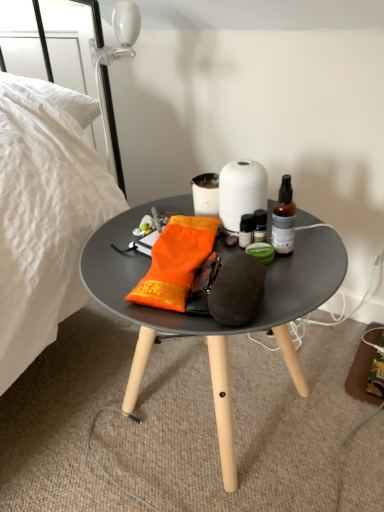
You are a GUI agent. You are given a task and a screenshot of the screen. Output one action in this format:
    pyautogui.click(x=<x>, y=<y>)
    Task: Click on the vacant point to the right of brown glass bottle at center
    
    Given the screenshot: What is the action you would take?
    pyautogui.click(x=321, y=247)